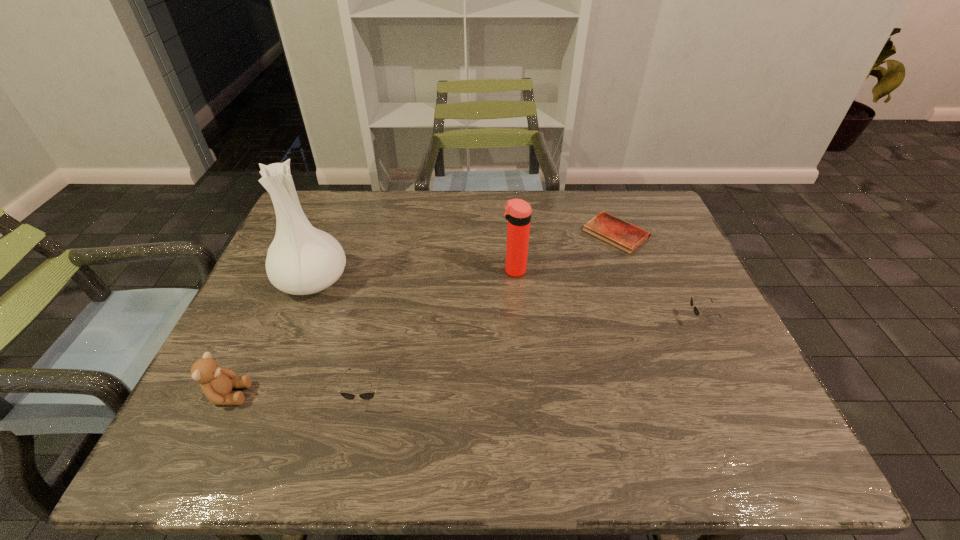
The image size is (960, 540). In order to click on the fourth object from right to left in this screenshot , I will do `click(365, 395)`.

What are the coordinates of `the taller sunglasses` in the screenshot? It's located at (365, 395).

Where is `the right sunglasses`? the right sunglasses is located at coordinates (696, 311).

Where is `the farther sunglasses`? This screenshot has width=960, height=540. the farther sunglasses is located at coordinates (x=696, y=311).

Locate an element on the screen. This screenshot has height=540, width=960. the shortest object is located at coordinates coord(619,233).

Where is `diary`? The height and width of the screenshot is (540, 960). diary is located at coordinates (619, 233).

Where is `vase`? vase is located at coordinates (301, 260).

Image resolution: width=960 pixels, height=540 pixels. I want to click on teddy bear, so click(217, 383).

You are a GUI agent. You are given a task and a screenshot of the screen. Output one action in this format:
    pyautogui.click(x=<x>, y=<y>)
    Task: Click on the thermos bottle
    
    Given the screenshot: What is the action you would take?
    pyautogui.click(x=517, y=211)

Locate an element on the screen. This screenshot has height=540, width=960. the fourth object from left to right is located at coordinates (517, 211).